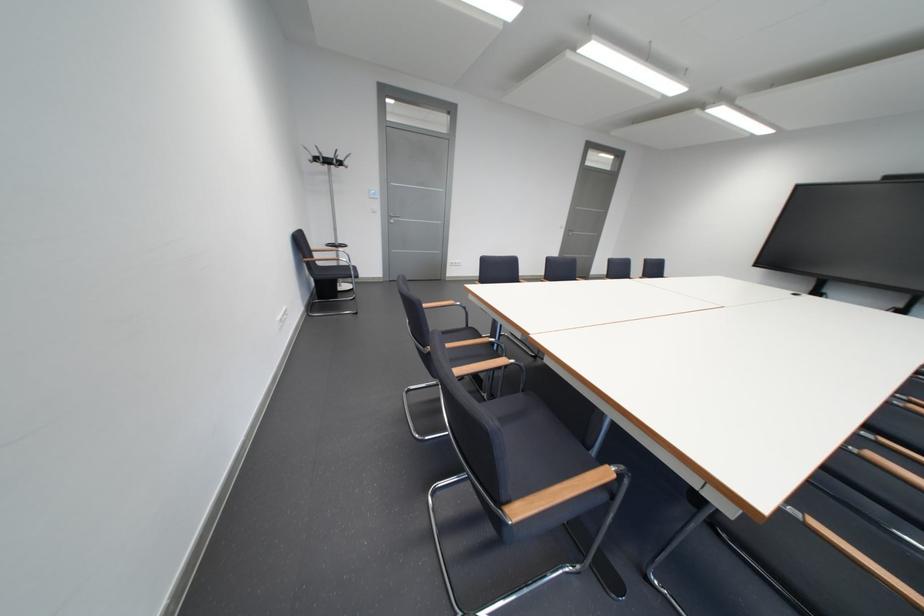
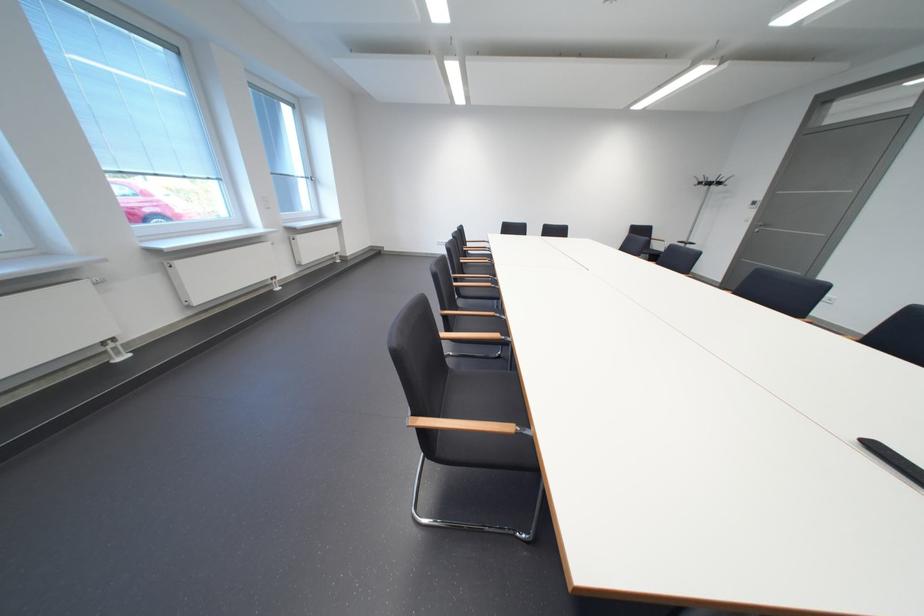
Locate, in the second image, the point that corresponds to (x=354, y=164) in the first image.

(723, 185)